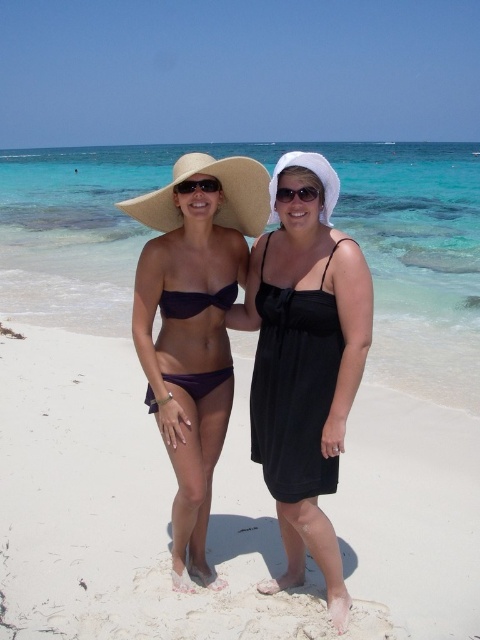
Does white sandy beach at center appear over matte purple bikini top at center?

No.

Does white sandy beach at center have a lesser width compared to matte purple bikini top at center?

No.

Is point (320, 602) more distant than point (215, 282)?

No, (320, 602) is closer to viewer.

Where is `white sandy beach at center`? white sandy beach at center is located at coordinates (123, 508).

Consider the image. Does black satin dress at center appear on the left side of purple matte bikini at center?

In fact, black satin dress at center is to the right of purple matte bikini at center.

Which of these two, black satin dress at center or purple matte bikini at center, stands taller?

black satin dress at center is taller.

Image resolution: width=480 pixels, height=640 pixels. I want to click on black satin dress at center, so click(305, 365).

Identify the location of matte purple bikini top at center. (193, 328).

Identify the location of matte purple bikini top at center. The width and height of the screenshot is (480, 640). (193, 328).

Locate an element on the screen. This screenshot has height=640, width=480. matte purple bikini top at center is located at coordinates (193, 328).